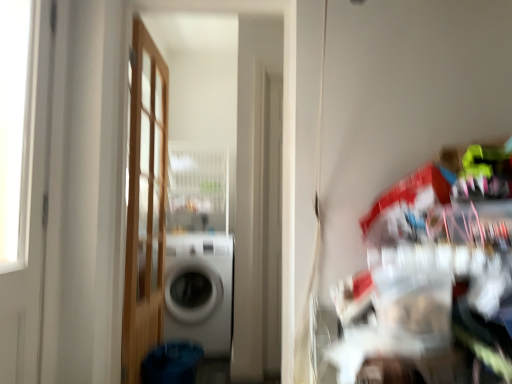
Question: Is wooden door at left, which ranks as the 2th door in left-to-right order, further to the viewer compared to white glossy washing machine at center?

Choices:
 (A) no
 (B) yes

Answer: (A)

Question: Is wooden door at left, which is the first door from back to front, not within white glossy washing machine at center?

Choices:
 (A) no
 (B) yes

Answer: (B)

Question: Can you confirm if wooden door at left, which is the first door from back to front, is taller than white glossy washing machine at center?

Choices:
 (A) no
 (B) yes

Answer: (B)

Question: From a real-world perspective, is wooden door at left, marked as the 2th door in a front-to-back arrangement, beneath white glossy washing machine at center?

Choices:
 (A) no
 (B) yes

Answer: (A)

Question: Is wooden door at left, the 1th door from the right, looking in the opposite direction of white glossy washing machine at center?

Choices:
 (A) no
 (B) yes

Answer: (A)

Question: Considering the relative sizes of wooden door at left, which is the first door from back to front, and white glossy washing machine at center in the image provided, is wooden door at left, which is the first door from back to front, bigger than white glossy washing machine at center?

Choices:
 (A) yes
 (B) no

Answer: (B)

Question: Is wooden door at left, which is the first door from back to front, positioned beyond the bounds of white glossy door at left, placed as the second door when sorted from right to left?

Choices:
 (A) no
 (B) yes

Answer: (B)

Question: Is wooden door at left, which is the first door from back to front, to the right of white glossy door at left, marked as the first door in a front-to-back arrangement, from the viewer's perspective?

Choices:
 (A) no
 (B) yes

Answer: (B)

Question: Can you confirm if wooden door at left, which is the first door from back to front, is bigger than white glossy door at left, marked as the first door in a front-to-back arrangement?

Choices:
 (A) no
 (B) yes

Answer: (B)

Question: Is wooden door at left, which is the first door from back to front, further to the viewer compared to white glossy door at left, placed as the second door when sorted from right to left?

Choices:
 (A) yes
 (B) no

Answer: (A)

Question: From the image's perspective, does wooden door at left, which is the first door from back to front, appear higher than white glossy door at left, which is the first door from left to right?

Choices:
 (A) no
 (B) yes

Answer: (A)

Question: Is wooden door at left, which ranks as the 2th door in left-to-right order, closer to camera compared to white glossy door at left, placed as the second door when sorted from right to left?

Choices:
 (A) yes
 (B) no

Answer: (B)

Question: Is white glossy door at left, placed as the second door when sorted from right to left, smaller than white glossy washing machine at center?

Choices:
 (A) yes
 (B) no

Answer: (A)